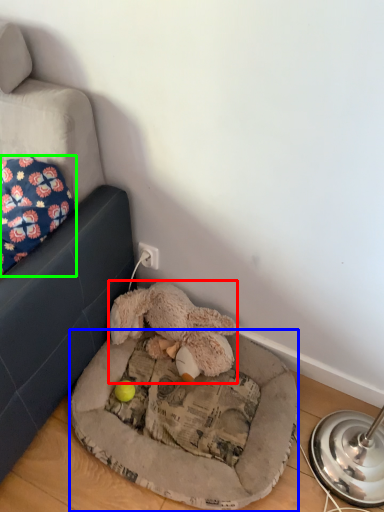
Question: Based on their relative distances, which object is nearer to toy (highlighted by a red box)? Choose from dog bed (highlighted by a blue box) and pillow (highlighted by a green box).

Choices:
 (A) dog bed
 (B) pillow

Answer: (A)